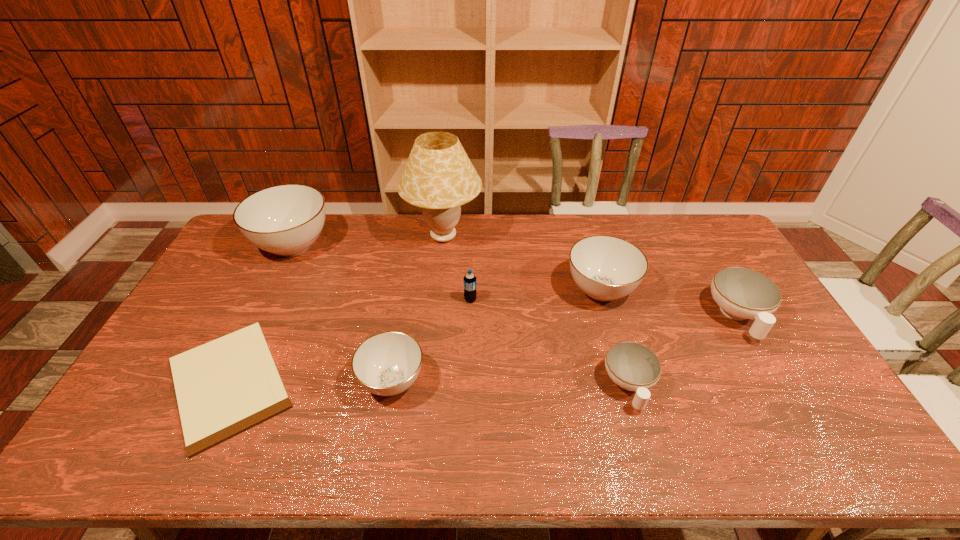
Where is `vacant space that satisfies the following two spatial constraints: 1. on the front side of the soda bottle; 2. on the left side of the biggest gray chinaware`? vacant space that satisfies the following two spatial constraints: 1. on the front side of the soda bottle; 2. on the left side of the biggest gray chinaware is located at coordinates (266, 300).